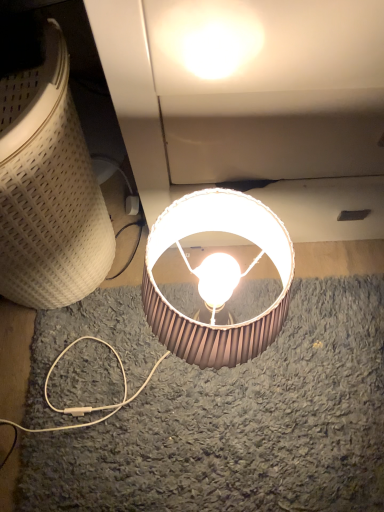
Describe the element at coordinates (48, 189) in the screenshot. I see `matte white lampshade at lower left, placed as the 1th lamp when sorted from left to right` at that location.

This screenshot has width=384, height=512. I want to click on matte white lampshade at lower left, placed as the 1th lamp when sorted from left to right, so click(x=48, y=189).

This screenshot has width=384, height=512. What do you see at coordinates (226, 232) in the screenshot?
I see `metallic silver lampshade at center, placed as the second lamp when sorted from left to right` at bounding box center [226, 232].

Find the location of a particular element. metallic silver lampshade at center, placed as the second lamp when sorted from left to right is located at coordinates (226, 232).

What is the approximate width of metallic silver lampshade at center, the 1th lamp when ordered from right to left?

metallic silver lampshade at center, the 1th lamp when ordered from right to left, is 10.30 inches in width.

Locate an element on the screen. The height and width of the screenshot is (512, 384). matte white lampshade at lower left, placed as the 1th lamp when sorted from left to right is located at coordinates (48, 189).

Is metallic silver lampshade at center, the 1th lamp when ordered from right to left, at the left side of matte white lampshade at lower left, the 2th lamp positioned from the right?

In fact, metallic silver lampshade at center, the 1th lamp when ordered from right to left, is to the right of matte white lampshade at lower left, the 2th lamp positioned from the right.

Between metallic silver lampshade at center, the 1th lamp when ordered from right to left, and matte white lampshade at lower left, the 2th lamp positioned from the right, which one is positioned in front?

Positioned in front is matte white lampshade at lower left, the 2th lamp positioned from the right.

Does point (175, 338) come behind point (27, 201)?

Yes, it is behind point (27, 201).

From the image's perspective, is metallic silver lampshade at center, the 1th lamp when ordered from right to left, positioned above or below matte white lampshade at lower left, the 2th lamp positioned from the right?

Based on their image positions, metallic silver lampshade at center, the 1th lamp when ordered from right to left, is located beneath matte white lampshade at lower left, the 2th lamp positioned from the right.

Consider the image. From a real-world perspective, between metallic silver lampshade at center, the 1th lamp when ordered from right to left, and matte white lampshade at lower left, the 2th lamp positioned from the right, who is vertically lower?

From a 3D spatial view, metallic silver lampshade at center, the 1th lamp when ordered from right to left, is below.

Does metallic silver lampshade at center, the 1th lamp when ordered from right to left, have a lesser width compared to matte white lampshade at lower left, the 2th lamp positioned from the right?

Yes.

From the picture: Who is shorter, metallic silver lampshade at center, the 1th lamp when ordered from right to left, or matte white lampshade at lower left, placed as the 1th lamp when sorted from left to right?

metallic silver lampshade at center, the 1th lamp when ordered from right to left.

Which of these two, metallic silver lampshade at center, the 1th lamp when ordered from right to left, or matte white lampshade at lower left, the 2th lamp positioned from the right, is smaller?

With smaller size is metallic silver lampshade at center, the 1th lamp when ordered from right to left.

Would you say metallic silver lampshade at center, placed as the second lamp when sorted from left to right, is inside or outside matte white lampshade at lower left, the 2th lamp positioned from the right?

metallic silver lampshade at center, placed as the second lamp when sorted from left to right, is spatially situated outside matte white lampshade at lower left, the 2th lamp positioned from the right.

Would you consider metallic silver lampshade at center, placed as the second lamp when sorted from left to right, to be distant from matte white lampshade at lower left, the 2th lamp positioned from the right?

No, metallic silver lampshade at center, placed as the second lamp when sorted from left to right, is not far away from matte white lampshade at lower left, the 2th lamp positioned from the right.

Could you tell me if metallic silver lampshade at center, the 1th lamp when ordered from right to left, is turned towards matte white lampshade at lower left, placed as the 1th lamp when sorted from left to right?

No.

How many degrees apart are the facing directions of metallic silver lampshade at center, the 1th lamp when ordered from right to left, and matte white lampshade at lower left, the 2th lamp positioned from the right?

metallic silver lampshade at center, the 1th lamp when ordered from right to left, and matte white lampshade at lower left, the 2th lamp positioned from the right, are facing 0.742 degrees away from each other.

How distant is metallic silver lampshade at center, placed as the second lamp when sorted from left to right, from matte white lampshade at lower left, the 2th lamp positioned from the right?

metallic silver lampshade at center, placed as the second lamp when sorted from left to right, is 10.77 inches from matte white lampshade at lower left, the 2th lamp positioned from the right.

Locate an element on the screen. The width and height of the screenshot is (384, 512). lamp above the metallic silver lampshade at center, the 1th lamp when ordered from right to left (from a real-world perspective) is located at coordinates (x=48, y=189).

Consider the image. Is matte white lampshade at lower left, placed as the 1th lamp when sorted from left to right, to the left or to the right of metallic silver lampshade at center, the 1th lamp when ordered from right to left, in the image?

matte white lampshade at lower left, placed as the 1th lamp when sorted from left to right, is positioned on metallic silver lampshade at center, the 1th lamp when ordered from right to left,'s left side.

Which is behind, matte white lampshade at lower left, placed as the 1th lamp when sorted from left to right, or metallic silver lampshade at center, the 1th lamp when ordered from right to left?

metallic silver lampshade at center, the 1th lamp when ordered from right to left, is further from the camera.

Does point (12, 258) lie behind point (202, 228)?

No.

From the image's perspective, is matte white lampshade at lower left, the 2th lamp positioned from the right, above metallic silver lampshade at center, placed as the second lamp when sorted from left to right?

Correct, matte white lampshade at lower left, the 2th lamp positioned from the right, appears higher than metallic silver lampshade at center, placed as the second lamp when sorted from left to right, in the image.

From a real-world perspective, is matte white lampshade at lower left, placed as the 1th lamp when sorted from left to right, on metallic silver lampshade at center, the 1th lamp when ordered from right to left?

Yes, from a real-world perspective, matte white lampshade at lower left, placed as the 1th lamp when sorted from left to right, is above metallic silver lampshade at center, the 1th lamp when ordered from right to left.

Between matte white lampshade at lower left, the 2th lamp positioned from the right, and metallic silver lampshade at center, placed as the second lamp when sorted from left to right, which one has larger width?

Wider between the two is matte white lampshade at lower left, the 2th lamp positioned from the right.

In terms of height, does matte white lampshade at lower left, the 2th lamp positioned from the right, look taller or shorter compared to metallic silver lampshade at center, placed as the second lamp when sorted from left to right?

Clearly, matte white lampshade at lower left, the 2th lamp positioned from the right, is taller compared to metallic silver lampshade at center, placed as the second lamp when sorted from left to right.

Is matte white lampshade at lower left, placed as the 1th lamp when sorted from left to right, bigger than metallic silver lampshade at center, the 1th lamp when ordered from right to left?

Indeed, matte white lampshade at lower left, placed as the 1th lamp when sorted from left to right, has a larger size compared to metallic silver lampshade at center, the 1th lamp when ordered from right to left.

Is metallic silver lampshade at center, placed as the second lamp when sorted from left to right, surrounded by matte white lampshade at lower left, the 2th lamp positioned from the right?

No, metallic silver lampshade at center, placed as the second lamp when sorted from left to right, is located outside of matte white lampshade at lower left, the 2th lamp positioned from the right.

Is matte white lampshade at lower left, placed as the 1th lamp when sorted from left to right, touching metallic silver lampshade at center, placed as the second lamp when sorted from left to right?

matte white lampshade at lower left, placed as the 1th lamp when sorted from left to right, is not next to metallic silver lampshade at center, placed as the second lamp when sorted from left to right, and they're not touching.

Is matte white lampshade at lower left, the 2th lamp positioned from the right, oriented away from metallic silver lampshade at center, placed as the second lamp when sorted from left to right?

No, metallic silver lampshade at center, placed as the second lamp when sorted from left to right, is not at the back of matte white lampshade at lower left, the 2th lamp positioned from the right.

Can you tell me how much matte white lampshade at lower left, placed as the 1th lamp when sorted from left to right, and metallic silver lampshade at center, placed as the second lamp when sorted from left to right, differ in facing direction?

matte white lampshade at lower left, placed as the 1th lamp when sorted from left to right, and metallic silver lampshade at center, placed as the second lamp when sorted from left to right, are facing 0.742 degrees away from each other.

This screenshot has width=384, height=512. What are the coordinates of `lamp located above the metallic silver lampshade at center, the 1th lamp when ordered from right to left (from the image's perspective)` in the screenshot? It's located at (48, 189).

The image size is (384, 512). I want to click on lamp on the right of the matte white lampshade at lower left, the 2th lamp positioned from the right, so click(226, 232).

You are a GUI agent. You are given a task and a screenshot of the screen. Output one action in this format:
    pyautogui.click(x=<x>, y=<y>)
    Task: Click on the lamp lying on the left of metallic silver lampshade at center, the 1th lamp when ordered from right to left
    This screenshot has width=384, height=512.
    Given the screenshot: What is the action you would take?
    pyautogui.click(x=48, y=189)